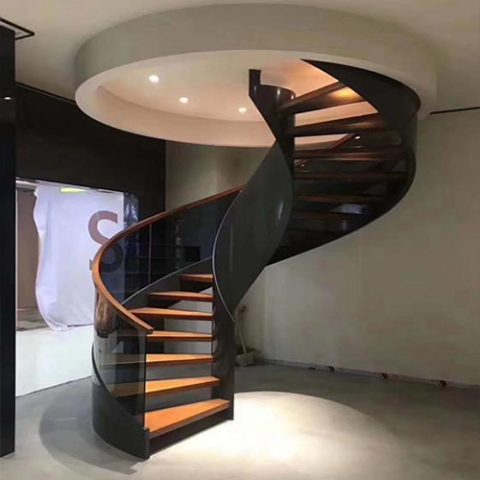
This screenshot has width=480, height=480. I want to click on white wall, so click(278, 299), click(395, 307), click(458, 184), click(203, 170).